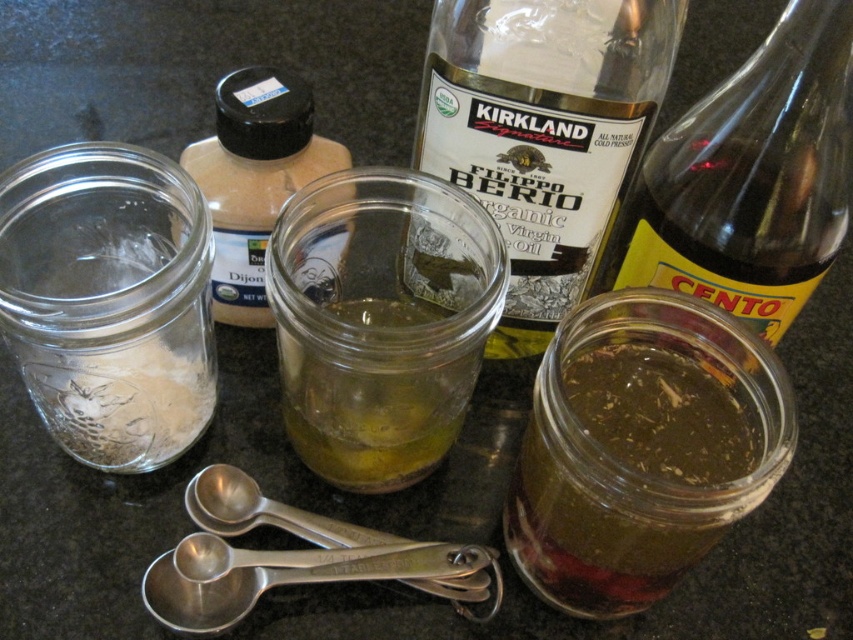
You are a chef preparing a recipe that requires precise measurements. You have two jars available on the countertop. The translucent glass jar at center and the clear glass jar at left. Which jar has a wider opening for adding ingredients?

The clear glass jar at left has a greater width compared to the translucent glass jar at center, so it has a wider opening for adding ingredients.

You are a chef preparing a recipe that requires you to pour the contents of the transparent glass bottle at right into the silver metallic measuring spoons at center. Can you do this without moving either object?

The transparent glass bottle at right is to the right of the silver metallic measuring spoons at center, so you cannot pour the contents from the transparent glass bottle at right into the silver metallic measuring spoons at center without moving at least one of them since they are not positioned adjacent to each other.